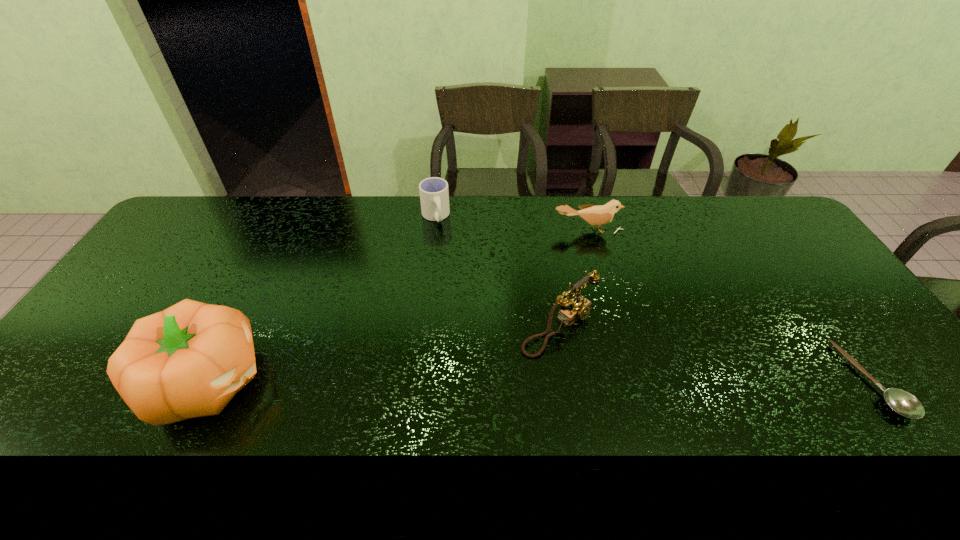
You are a GUI agent. You are given a task and a screenshot of the screen. Output one action in this format:
    pyautogui.click(x=<x>, y=<y>)
    Task: Click on the pumpkin present at the near edge
    
    Given the screenshot: What is the action you would take?
    pyautogui.click(x=189, y=360)

This screenshot has width=960, height=540. Identify the location of ladle that is positioned at the near edge. (903, 403).

The image size is (960, 540). Identify the location of object that is positioned at the right edge. (903, 403).

The width and height of the screenshot is (960, 540). Identify the location of object that is at the near right corner. (903, 403).

You are a GUI agent. You are given a task and a screenshot of the screen. Output one action in this format:
    pyautogui.click(x=<x>, y=<y>)
    Task: Click on the free location at the far edge
    
    Given the screenshot: What is the action you would take?
    pyautogui.click(x=646, y=232)

Identify the location of vacant space at the near edge. (502, 408).

What are the coordinates of `blank space at the right edge of the desktop` in the screenshot? It's located at (789, 241).

Identify the location of free location at the far right corner of the desktop. This screenshot has width=960, height=540. [x=765, y=221].

Where is `free space between the cup and the telephone`? Image resolution: width=960 pixels, height=540 pixels. free space between the cup and the telephone is located at coordinates [x=497, y=272].

Where is `free space between the fourth object from right to left and the telephone`? Image resolution: width=960 pixels, height=540 pixels. free space between the fourth object from right to left and the telephone is located at coordinates (497, 272).